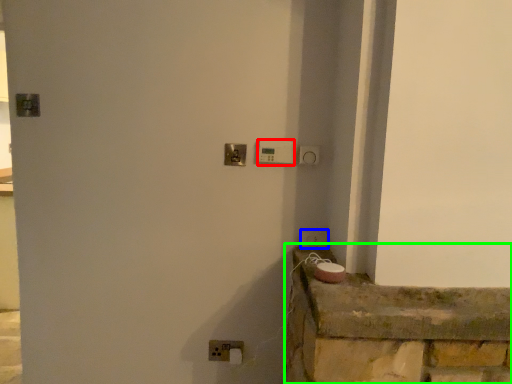
Question: Considering the real-world distances, which object is closest to light switch (highlighted by a red box)? light switch (highlighted by a blue box) or ledge (highlighted by a green box).

Choices:
 (A) light switch
 (B) ledge

Answer: (A)